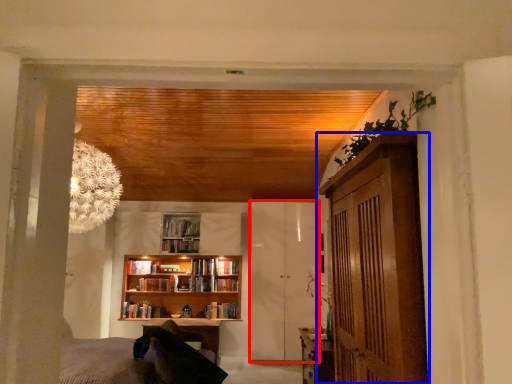
Question: Among these objects, which one is nearest to the camera, barn door (highlighted by a red box) or cabinetry (highlighted by a blue box)?

Choices:
 (A) barn door
 (B) cabinetry

Answer: (B)